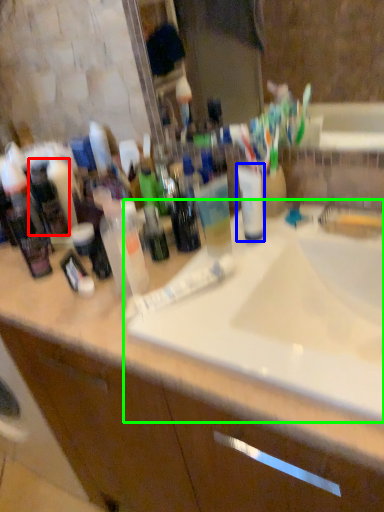
Question: Which object is the farthest from toiletry (highlighted by a red box)? Choose among these: mouthwash (highlighted by a blue box) or sink (highlighted by a green box).

Choices:
 (A) mouthwash
 (B) sink

Answer: (B)